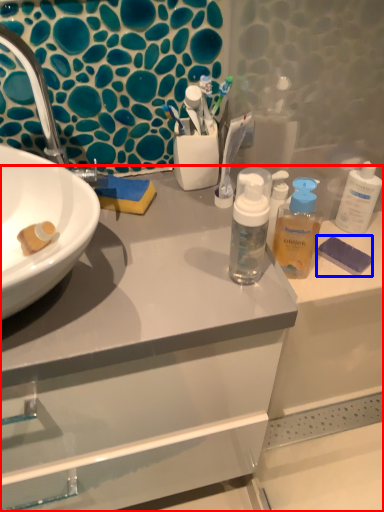
Question: Which point is closer to the camera, bathroom cabinet (highlighted by a red box) or soap (highlighted by a blue box)?

Choices:
 (A) bathroom cabinet
 (B) soap

Answer: (A)